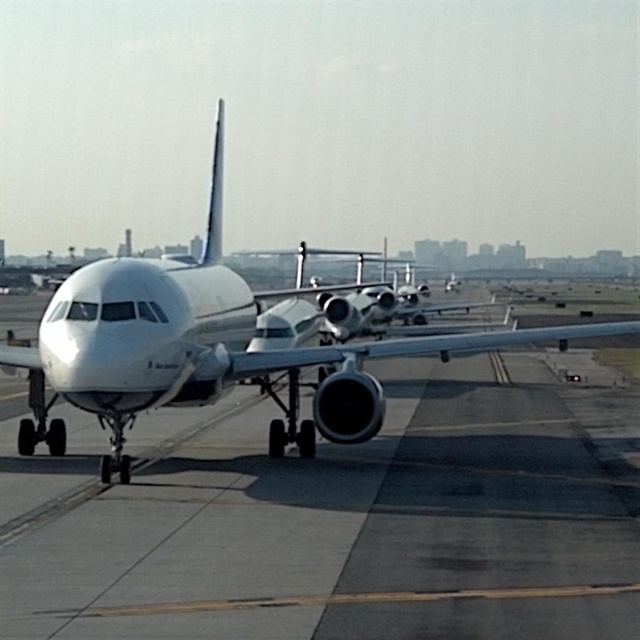
You are a maintenance worker needing to access the landing gear of the white matte airplane at center. The smooth concrete tarmac at center is where you currently stand. In which direction should you move to reach the landing gear?

The smooth concrete tarmac at center is to the right of the white matte airplane at center, so you should move to your left to reach the landing gear of the white matte airplane at center.

You are a maintenance worker on an airport tarmac. You need to walk from the smooth concrete tarmac at center to the white matte airplane at center. Which direction should you walk to reach the airplane?

The smooth concrete tarmac at center is in front of the white matte airplane at center, so you should walk backward to reach the airplane.

You are a maintenance worker on the airport tarmac. You need to inspect the area between the smooth concrete tarmac at center and the white matte airplane at center. Which object is directly underneath the other?

The smooth concrete tarmac at center is located below the white matte airplane at center, meaning the tarmac is underneath the airplane.